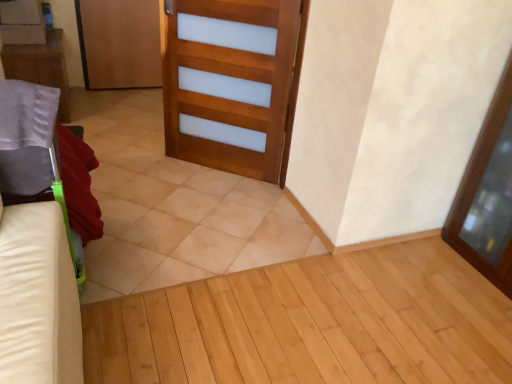
This screenshot has width=512, height=384. I want to click on vacant space situated on the left part of wooden door at center, the first door when ordered from bottom to top, so click(141, 166).